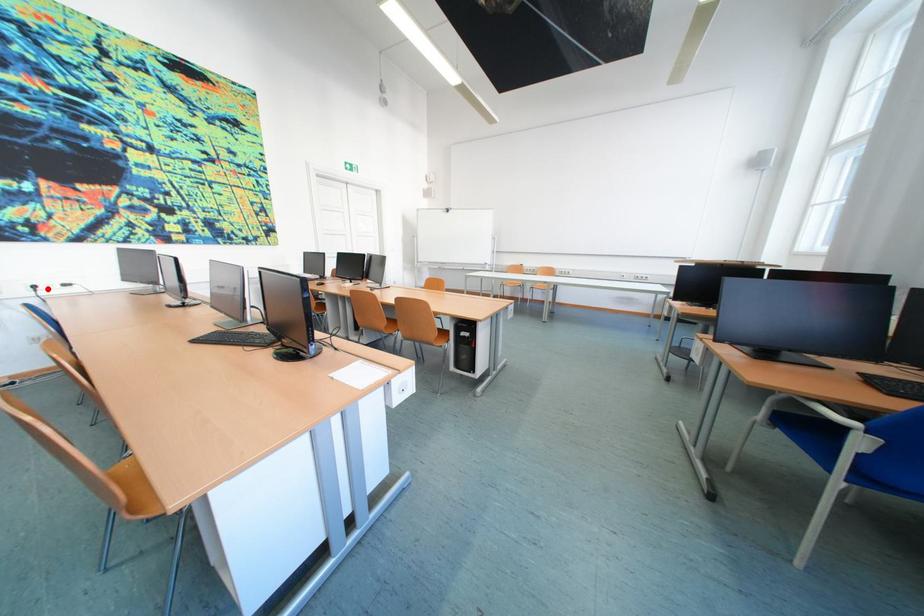
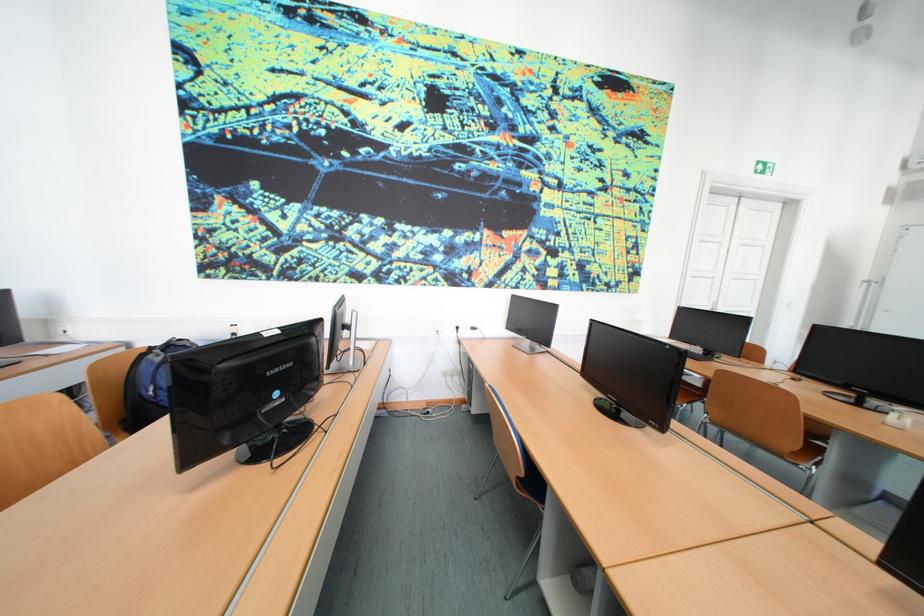
Question: I am providing you with two images of the same scene from different viewpoints. A red point is shown in image1. For the corresponding object point in image2, is it positioned nearer or farther from the camera?

Choices:
 (A) Nearer
 (B) Farther

Answer: (A)